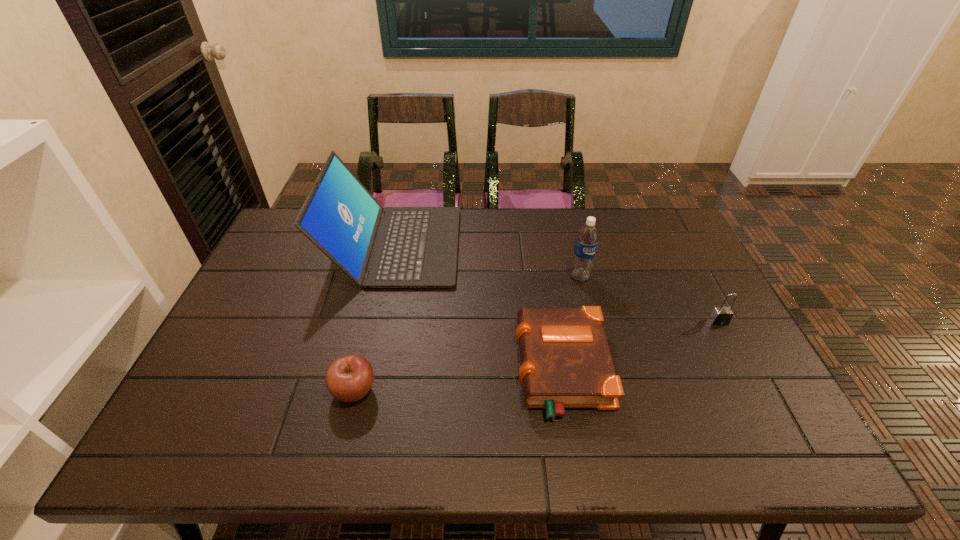
Where is `vacant space located on the spine side of the Bible`? vacant space located on the spine side of the Bible is located at coordinates (413, 369).

Find the location of a particular element. vacant position located 0.260m on the spine side of the Bible is located at coordinates (413, 369).

The height and width of the screenshot is (540, 960). I want to click on object present at the far edge, so click(392, 247).

Locate an element on the screen. object located at the near edge is located at coordinates (565, 360).

You are a GUI agent. You are given a task and a screenshot of the screen. Output one action in this format:
    pyautogui.click(x=<x>, y=<y>)
    Task: Click on the object present at the right edge
    Image resolution: width=960 pixels, height=540 pixels.
    Given the screenshot: What is the action you would take?
    pyautogui.click(x=721, y=315)

At what (x,y) coordinates should I click in order to perform the action: click on vacant space at the far edge of the desktop. Please return your answer as a coordinate pair (x, y). This screenshot has height=540, width=960. Looking at the image, I should click on (553, 215).

Identify the location of vacant point at the near edge. (614, 431).

At what (x,y) coordinates should I click in order to perform the action: click on free space at the left edge of the desktop. Please return your answer as a coordinate pair (x, y). Looking at the image, I should click on (266, 299).

I want to click on vacant space at the right edge of the desktop, so click(676, 269).

Find the location of a particular element. blank area at the far right corner is located at coordinates (652, 242).